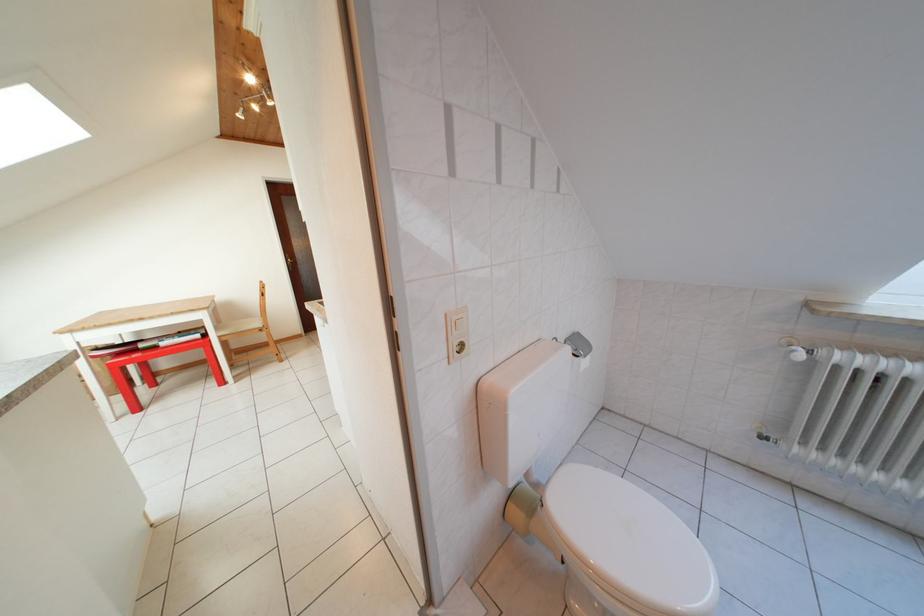
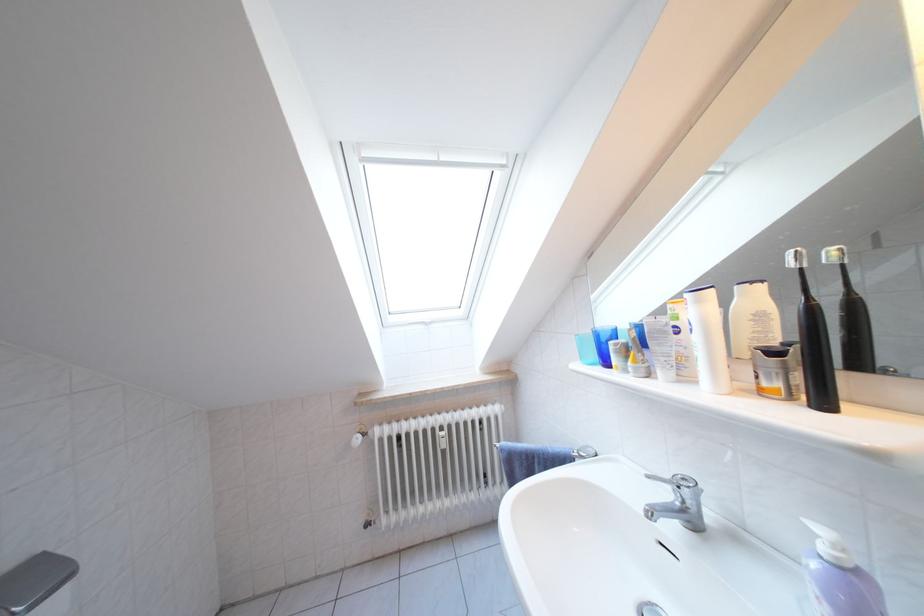
Question: The first image is from the beginning of the video and the second image is from the end. How did the camera likely rotate when shooting the video?

Choices:
 (A) Left
 (B) Right
 (C) Up
 (D) Down

Answer: (B)